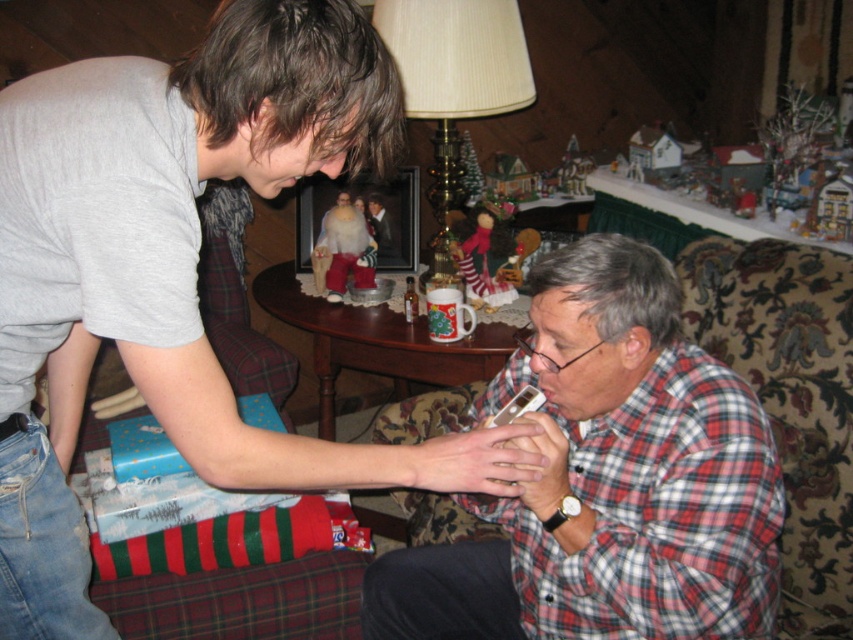
Question: Which point is closer to the camera taking this photo?

Choices:
 (A) (30, 556)
 (B) (581, 332)

Answer: (A)

Question: Observing the image, what is the correct spatial positioning of plaid flannel shirt at lower right in reference to plaid fabric shirt at lower right?

Choices:
 (A) above
 (B) below

Answer: (A)

Question: Can you confirm if plaid flannel shirt at lower right is positioned below plaid fabric shirt at lower right?

Choices:
 (A) yes
 (B) no

Answer: (B)

Question: Which point is closer to the camera?

Choices:
 (A) (700, 625)
 (B) (352, 56)

Answer: (B)

Question: Is plaid flannel shirt at lower right positioned in front of plaid fabric shirt at lower right?

Choices:
 (A) no
 (B) yes

Answer: (B)